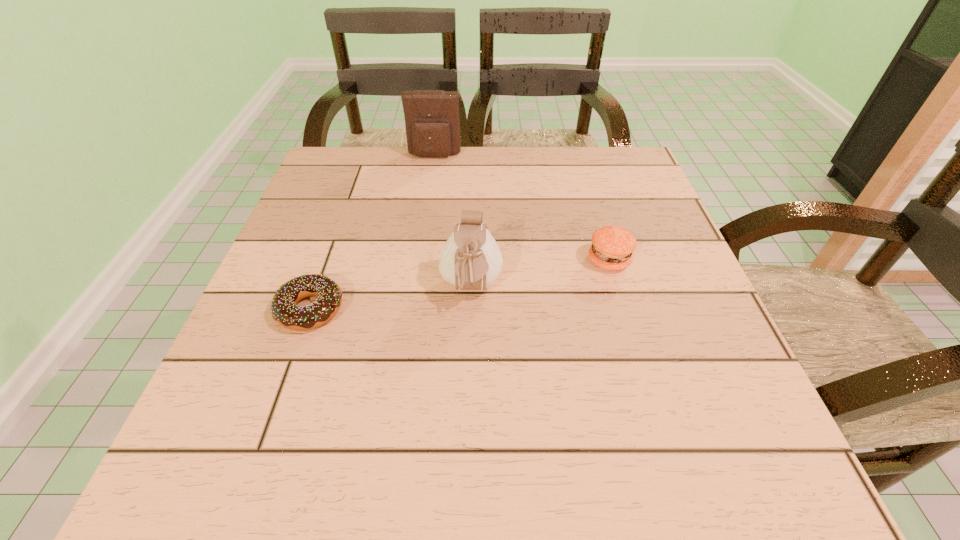
Where is `the farthest object`? The width and height of the screenshot is (960, 540). the farthest object is located at coordinates (432, 122).

Where is `the nearer pouch`? The image size is (960, 540). the nearer pouch is located at coordinates (470, 259).

Image resolution: width=960 pixels, height=540 pixels. I want to click on the second shortest object, so click(x=612, y=246).

Where is `the rightmost object`? This screenshot has width=960, height=540. the rightmost object is located at coordinates (612, 246).

Identify the location of doughnut. This screenshot has height=540, width=960. (283, 306).

I want to click on the shortest object, so click(283, 306).

Where is `vacant space positioned 0.210m with an open flap on the farthest object`? This screenshot has width=960, height=540. vacant space positioned 0.210m with an open flap on the farthest object is located at coordinates pyautogui.click(x=427, y=210).

Locate an element on the screen. This screenshot has width=960, height=540. free spot located on the front-facing side of the nearer pouch is located at coordinates (469, 393).

The height and width of the screenshot is (540, 960). In order to click on blank space located on the left of the patty in this screenshot , I will do `click(393, 260)`.

Locate an element on the screen. The image size is (960, 540). vacant point located on the front of the doughnut is located at coordinates (x=288, y=371).